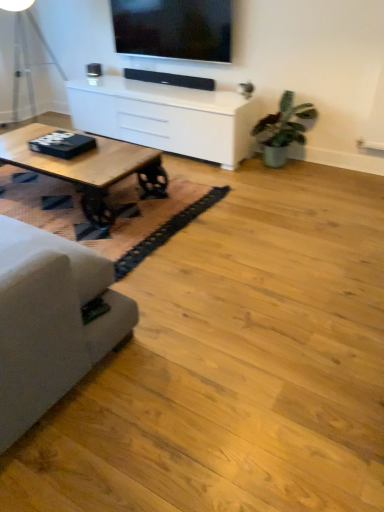
Question: From the image's perspective, is green matte plant at right located beneath suede gray couch at left?

Choices:
 (A) no
 (B) yes

Answer: (A)

Question: Is suede gray couch at left inside green matte plant at right?

Choices:
 (A) no
 (B) yes

Answer: (A)

Question: Is green matte plant at right shorter than suede gray couch at left?

Choices:
 (A) yes
 (B) no

Answer: (A)

Question: Is green matte plant at right facing towards suede gray couch at left?

Choices:
 (A) yes
 (B) no

Answer: (A)

Question: Is green matte plant at right not inside suede gray couch at left?

Choices:
 (A) yes
 (B) no

Answer: (A)

Question: Is point (16, 12) closer or farther from the camera than point (281, 147)?

Choices:
 (A) farther
 (B) closer

Answer: (A)

Question: In terms of width, does metallic silver table lamp at left look wider or thinner when compared to green matte plant at right?

Choices:
 (A) wide
 (B) thin

Answer: (A)

Question: In terms of size, does metallic silver table lamp at left appear bigger or smaller than green matte plant at right?

Choices:
 (A) small
 (B) big

Answer: (B)

Question: In terms of height, does metallic silver table lamp at left look taller or shorter compared to green matte plant at right?

Choices:
 (A) short
 (B) tall

Answer: (B)

Question: Would you say green matte plant at right is to the left or to the right of wooden table at left in the picture?

Choices:
 (A) left
 (B) right

Answer: (B)

Question: From the image's perspective, is green matte plant at right positioned above or below wooden table at left?

Choices:
 (A) below
 (B) above

Answer: (B)

Question: Considering the positions of point (273, 141) and point (115, 179), is point (273, 141) closer or farther from the camera than point (115, 179)?

Choices:
 (A) farther
 (B) closer

Answer: (A)

Question: From a real-world perspective, is green matte plant at right physically located above or below wooden table at left?

Choices:
 (A) below
 (B) above

Answer: (B)

Question: In terms of size, does matte black tv at upper center appear bigger or smaller than green matte plant at right?

Choices:
 (A) small
 (B) big

Answer: (A)

Question: Is matte black tv at upper center inside or outside of green matte plant at right?

Choices:
 (A) outside
 (B) inside

Answer: (A)